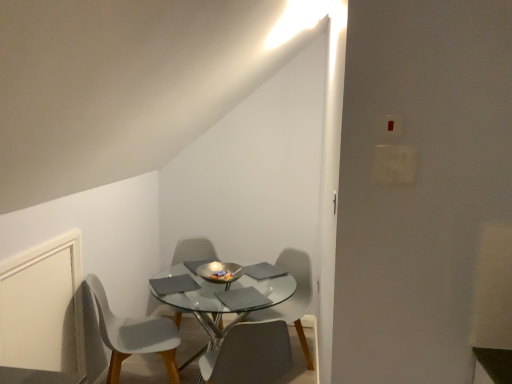
How much space does matte gray chair at center, which ranks as the 4th chair in left-to-right order, occupy horizontally?

The width of matte gray chair at center, which ranks as the 4th chair in left-to-right order, is 20.82 inches.

Identify the location of matte gray chair at center, the first chair viewed from the right. The height and width of the screenshot is (384, 512). (292, 297).

Describe the element at coordinates (220, 272) in the screenshot. Image resolution: width=512 pixels, height=384 pixels. I see `shiny metallic bowl at center` at that location.

What do you see at coordinates (134, 335) in the screenshot? I see `white plastic chair at lower left, which is the 1th chair in left-to-right order` at bounding box center [134, 335].

What do you see at coordinates (249, 355) in the screenshot?
I see `matte gray chair at center, positioned as the 3th chair in left-to-right order` at bounding box center [249, 355].

Locate an element on the screen. This screenshot has width=512, height=384. white plastic chair at center, acting as the second chair starting from the left is located at coordinates (194, 251).

The height and width of the screenshot is (384, 512). What do you see at coordinates (194, 251) in the screenshot? I see `white plastic chair at center, which ranks as the third chair in right-to-left order` at bounding box center [194, 251].

Locate an element on the screen. This screenshot has height=384, width=512. white matte door at lower left is located at coordinates (42, 313).

Identify the location of chair located below the white plastic chair at lower left, which is the 1th chair in left-to-right order (from the image's perspective). (249, 355).

Is white plastic chair at lower left, which is the 1th chair in left-to-right order, at the back of matte gray chair at center, which ranks as the second chair in right-to-left order?

matte gray chair at center, which ranks as the second chair in right-to-left order, does not have its back to white plastic chair at lower left, which is the 1th chair in left-to-right order.

From the image's perspective, is matte gray chair at center, positioned as the 3th chair in left-to-right order, above white plastic chair at lower left, which is the 1th chair in left-to-right order?

Actually, matte gray chair at center, positioned as the 3th chair in left-to-right order, appears below white plastic chair at lower left, which is the 1th chair in left-to-right order, in the image.

Considering the positions of objects matte gray chair at center, positioned as the 3th chair in left-to-right order, and white plastic chair at lower left, which is the 1th chair in left-to-right order, in the image provided, who is in front, matte gray chair at center, positioned as the 3th chair in left-to-right order, or white plastic chair at lower left, which is the 1th chair in left-to-right order,?

matte gray chair at center, positioned as the 3th chair in left-to-right order, is more forward.

Is white plastic light switch at upper right not near matte gray chair at center, positioned as the 3th chair in left-to-right order?

No, white plastic light switch at upper right is not far from matte gray chair at center, positioned as the 3th chair in left-to-right order.

Can we say white plastic light switch at upper right lies outside matte gray chair at center, which ranks as the second chair in right-to-left order?

Yes.

How many degrees apart are the facing directions of white plastic light switch at upper right and matte gray chair at center, which ranks as the second chair in right-to-left order?

165 degrees separate the facing orientations of white plastic light switch at upper right and matte gray chair at center, which ranks as the second chair in right-to-left order.

Considering the sizes of objects white plastic chair at center, which ranks as the third chair in right-to-left order, and shiny metallic bowl at center in the image provided, who is smaller, white plastic chair at center, which ranks as the third chair in right-to-left order, or shiny metallic bowl at center?

With smaller size is shiny metallic bowl at center.

Between white plastic chair at center, acting as the second chair starting from the left, and shiny metallic bowl at center, which one appears on the right side from the viewer's perspective?

Positioned to the right is shiny metallic bowl at center.

Looking at this image, from a real-world perspective, which is physically above, white plastic chair at center, which ranks as the third chair in right-to-left order, or shiny metallic bowl at center?

shiny metallic bowl at center.

Between white plastic chair at lower left, which is the 1th chair in left-to-right order, and white matte door at lower left, which one has larger size?

white plastic chair at lower left, which is the 1th chair in left-to-right order, is bigger.

From the picture: From a real-world perspective, between white plastic chair at lower left, the fourth chair when ordered from right to left, and white matte door at lower left, who is vertically higher?

white matte door at lower left, from a real-world perspective.

Which is in front, point (161, 340) or point (63, 254)?

The point (63, 254) is closer to the camera.

How much distance is there between white plastic chair at lower left, the fourth chair when ordered from right to left, and white matte door at lower left?

They are 15.09 inches apart.

Looking at this image, from a real-world perspective, who is located higher, white matte door at lower left or white plastic chair at center, which ranks as the third chair in right-to-left order?

white matte door at lower left.

Considering the positions of objects white matte door at lower left and white plastic chair at center, acting as the second chair starting from the left, in the image provided, who is behind, white matte door at lower left or white plastic chair at center, acting as the second chair starting from the left,?

white plastic chair at center, acting as the second chair starting from the left.

Can you tell me how much white matte door at lower left and white plastic chair at center, acting as the second chair starting from the left, differ in facing direction?

The facing directions of white matte door at lower left and white plastic chair at center, acting as the second chair starting from the left, are 69.9 degrees apart.

Which is less distant, (48,268) or (183,253)?

Point (48,268) is positioned closer to the camera compared to point (183,253).

Where is `the 1st chair to the left of the matte gray chair at center, which ranks as the 4th chair in left-to-right order, starting your count from the anchor`? The height and width of the screenshot is (384, 512). the 1st chair to the left of the matte gray chair at center, which ranks as the 4th chair in left-to-right order, starting your count from the anchor is located at coordinates (249, 355).

From the image's perspective, between matte gray chair at center, positioned as the 3th chair in left-to-right order, and matte gray chair at center, the first chair viewed from the right, who is located below?

matte gray chair at center, positioned as the 3th chair in left-to-right order, appears lower in the image.

Considering the positions of point (264, 368) and point (288, 261), is point (264, 368) closer or farther from the camera than point (288, 261)?

Point (264, 368) appears to be closer to the viewer than point (288, 261).

Are matte gray chair at center, which ranks as the second chair in right-to-left order, and matte gray chair at center, which ranks as the 4th chair in left-to-right order, located far from each other?

They are positioned close to each other.

Is point (220, 326) positioned behind point (281, 350)?

Yes, it is behind point (281, 350).

Which chair is the 3rd one when counting from the front of the white plastic chair at center, acting as the second chair starting from the left? Please provide its 2D coordinates.

[(249, 355)]

What's the angular difference between white plastic chair at center, acting as the second chair starting from the left, and matte gray chair at center, which ranks as the second chair in right-to-left order,'s facing directions?

The angular difference between white plastic chair at center, acting as the second chair starting from the left, and matte gray chair at center, which ranks as the second chair in right-to-left order, is 179 degrees.

Is white plastic chair at center, which ranks as the third chair in right-to-left order, to the left of matte gray chair at center, which ranks as the second chair in right-to-left order, from the viewer's perspective?

Yes.

Find the location of a particular element. The width and height of the screenshot is (512, 384). chair in front of the white plastic chair at lower left, which is the 1th chair in left-to-right order is located at coordinates (249, 355).

Where is `chair that is the 2nd object to the left of the white plastic light switch at upper right, starting at the anchor`? This screenshot has width=512, height=384. chair that is the 2nd object to the left of the white plastic light switch at upper right, starting at the anchor is located at coordinates (249, 355).

From the image, which object appears to be nearer to transparent glass table at center, white plastic chair at lower left, the fourth chair when ordered from right to left, or white matte door at lower left?

The object closer to transparent glass table at center is white plastic chair at lower left, the fourth chair when ordered from right to left.

Estimate the real-world distances between objects in this image. Which object is further from white plastic light switch at upper right, shiny metallic bowl at center or white plastic chair at center, acting as the second chair starting from the left?

white plastic chair at center, acting as the second chair starting from the left, lies further to white plastic light switch at upper right than the other object.

Which object lies further to the anchor point matte gray chair at center, which ranks as the 4th chair in left-to-right order, white plastic light switch at upper right or matte gray chair at center, positioned as the 3th chair in left-to-right order?

Based on the image, white plastic light switch at upper right appears to be further to matte gray chair at center, which ranks as the 4th chair in left-to-right order.

Considering their positions, is white plastic chair at lower left, the fourth chair when ordered from right to left, positioned further to transparent glass table at center than matte gray chair at center, which ranks as the 4th chair in left-to-right order?

white plastic chair at lower left, the fourth chair when ordered from right to left, is positioned further to the anchor transparent glass table at center.

Considering their positions, is shiny metallic bowl at center positioned closer to white plastic chair at center, acting as the second chair starting from the left, than white plastic light switch at upper right?

shiny metallic bowl at center is closer to white plastic chair at center, acting as the second chair starting from the left.

Based on their spatial positions, is shiny metallic bowl at center or matte gray chair at center, which ranks as the 4th chair in left-to-right order, further from transparent glass table at center?

The object further to transparent glass table at center is matte gray chair at center, which ranks as the 4th chair in left-to-right order.

From the image, which object appears to be farther from white plastic chair at center, which ranks as the third chair in right-to-left order, matte gray chair at center, which ranks as the second chair in right-to-left order, or white plastic chair at lower left, the fourth chair when ordered from right to left?

The object further to white plastic chair at center, which ranks as the third chair in right-to-left order, is matte gray chair at center, which ranks as the second chair in right-to-left order.

From the image, which object appears to be nearer to matte gray chair at center, which ranks as the 4th chair in left-to-right order, white plastic light switch at upper right or white matte door at lower left?

The object closer to matte gray chair at center, which ranks as the 4th chair in left-to-right order, is white matte door at lower left.

In order to click on coffee table between matte gray chair at center, which ranks as the second chair in right-to-left order, and white plastic chair at center, which ranks as the third chair in right-to-left order, in the front-back direction in this screenshot , I will do `click(219, 300)`.

Identify the location of coffee table between matte gray chair at center, positioned as the 3th chair in left-to-right order, and shiny metallic bowl at center, along the z-axis. (x=219, y=300).

Where is `bowl between white matte door at lower left and matte gray chair at center, which ranks as the 4th chair in left-to-right order`? Image resolution: width=512 pixels, height=384 pixels. bowl between white matte door at lower left and matte gray chair at center, which ranks as the 4th chair in left-to-right order is located at coordinates (220, 272).

You are a GUI agent. You are given a task and a screenshot of the screen. Output one action in this format:
    pyautogui.click(x=<x>, y=<y>)
    Task: Click on the coffee table between white matte door at lower left and matte gray chair at center, which ranks as the second chair in right-to-left order, from left to right
    The height and width of the screenshot is (384, 512).
    Given the screenshot: What is the action you would take?
    pyautogui.click(x=219, y=300)